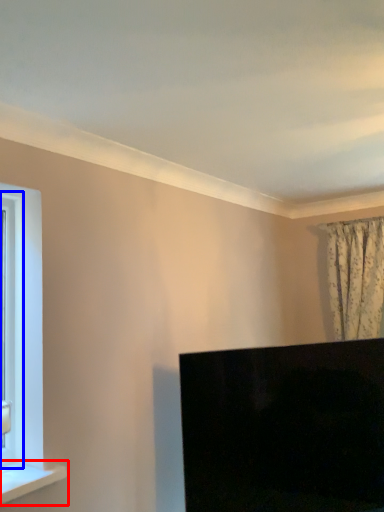
Question: Which object is closer to the camera taking this photo, window sill (highlighted by a red box) or window frame (highlighted by a blue box)?

Choices:
 (A) window sill
 (B) window frame

Answer: (A)